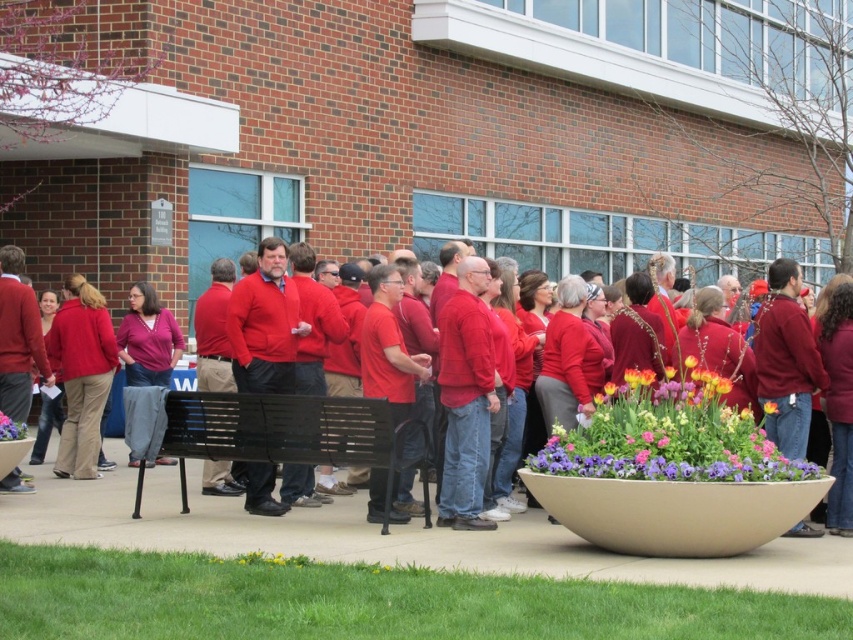
You are a photographer trying to capture a photo of the group while avoiding the vibrant floral bouquet at center. Since you can only move sideways, which direction should you move to frame the matte red sweater at center without the bouquet?

The matte red sweater at center is to the left of vibrant floral bouquet at center. Therefore, moving to the left will allow you to frame the matte red sweater at center while excluding the bouquet.